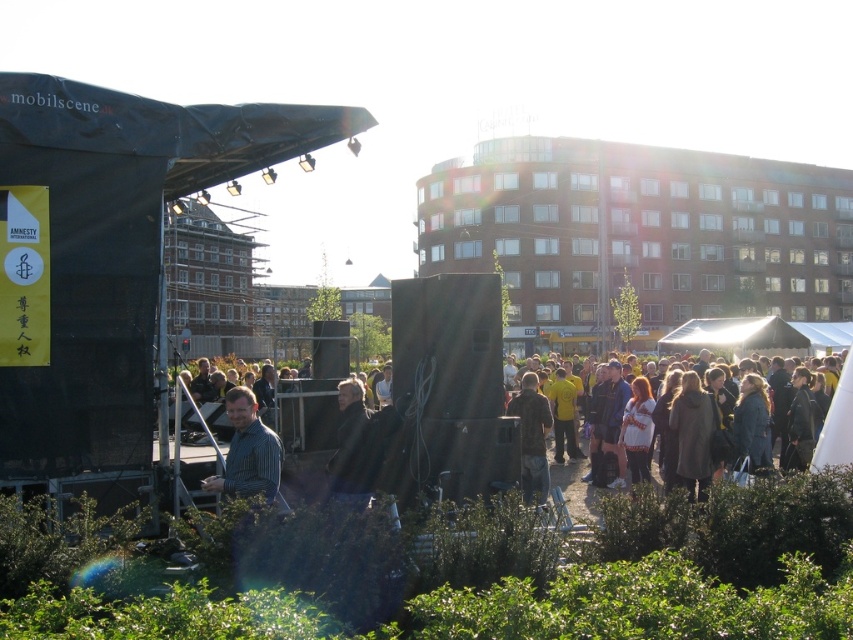
Consider the image. Can you confirm if striped shirt at center is shorter than camouflage fabric jacket at center?

Indeed, striped shirt at center has a lesser height compared to camouflage fabric jacket at center.

Does striped shirt at center have a greater height compared to camouflage fabric jacket at center?

In fact, striped shirt at center may be shorter than camouflage fabric jacket at center.

What do you see at coordinates (247, 451) in the screenshot? This screenshot has height=640, width=853. I see `striped shirt at center` at bounding box center [247, 451].

You are a GUI agent. You are given a task and a screenshot of the screen. Output one action in this format:
    pyautogui.click(x=<x>, y=<y>)
    Task: Click on the striped shirt at center
    This screenshot has height=640, width=853.
    Given the screenshot: What is the action you would take?
    pyautogui.click(x=247, y=451)